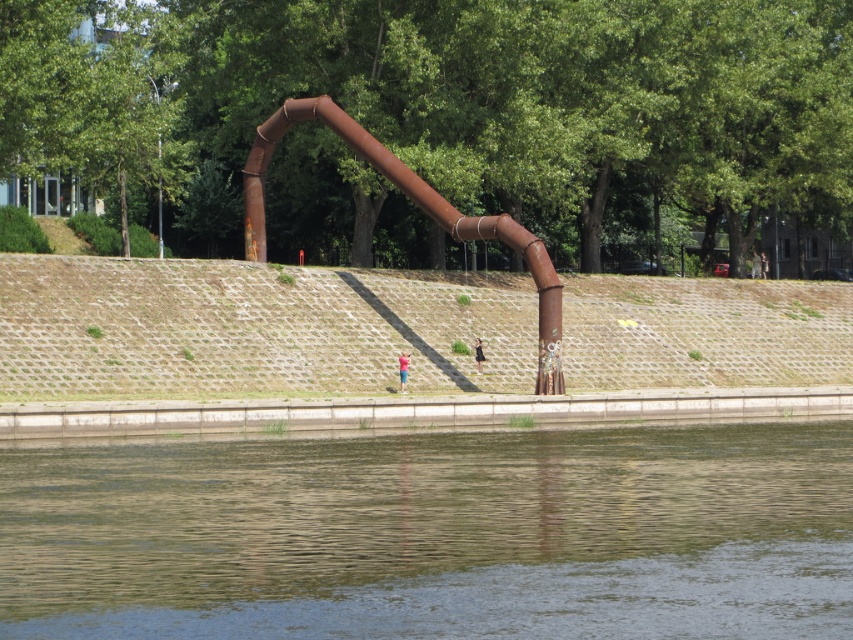
Question: Among these points, which one is farthest from the camera?

Choices:
 (A) (206, 480)
 (B) (401, 376)
 (C) (479, 364)
 (D) (252, 202)

Answer: (D)

Question: Does rusty metal water pipe at center have a larger size compared to black fabric person at center?

Choices:
 (A) no
 (B) yes

Answer: (B)

Question: Which object is the farthest from the light blue shirt at center?

Choices:
 (A) rusty metal water pipe at center
 (B) black fabric person at center

Answer: (A)

Question: Does rusty metal water pipe at center appear on the right side of light blue shirt at center?

Choices:
 (A) yes
 (B) no

Answer: (B)

Question: Does brown water at lower center have a larger size compared to black fabric person at center?

Choices:
 (A) yes
 (B) no

Answer: (A)

Question: Which object appears closest to the camera in this image?

Choices:
 (A) brown water at lower center
 (B) black fabric person at center

Answer: (A)